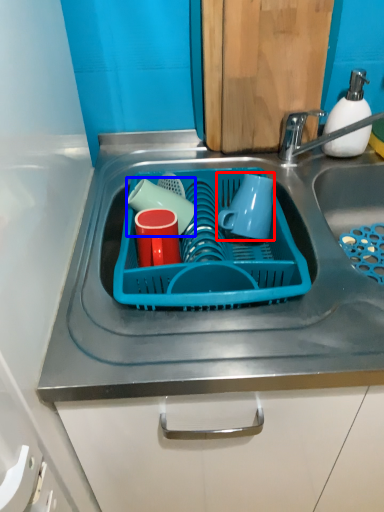
Question: Which object appears farthest to the camera in this image, mug (highlighted by a red box) or tableware (highlighted by a blue box)?

Choices:
 (A) mug
 (B) tableware

Answer: (B)